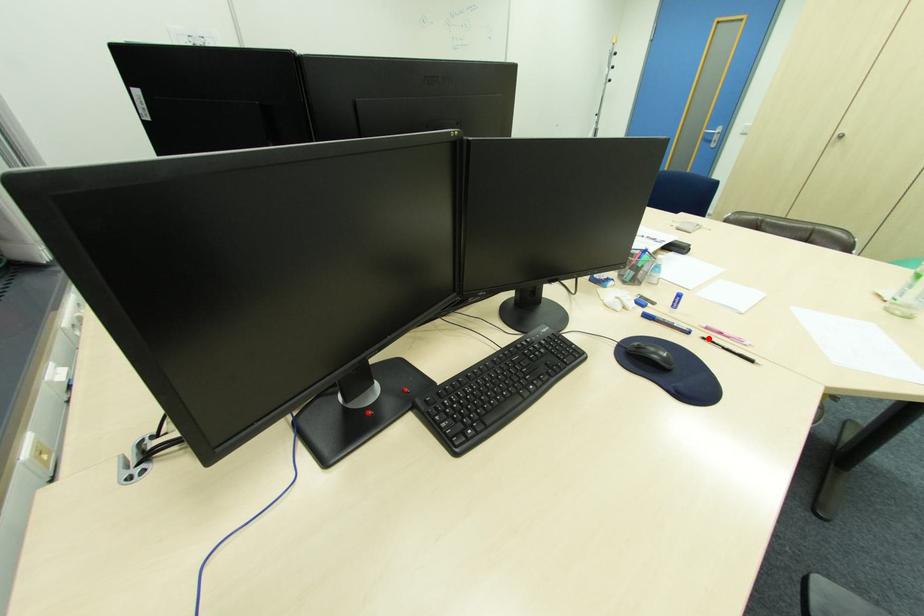
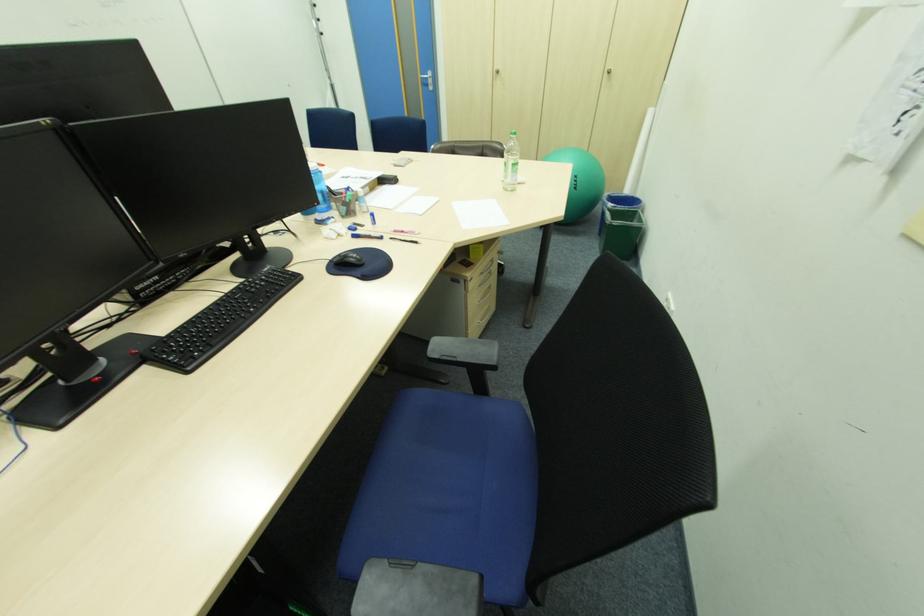
Find the pixel in the second image that matches the highlighted location in the first image.

(396, 238)